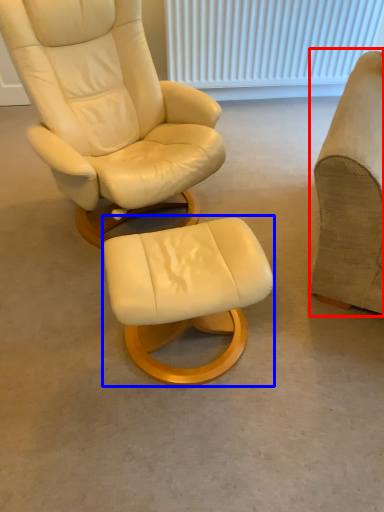
Question: Which point is closer to the camera, chair (highlighted by a red box) or stool (highlighted by a blue box)?

Choices:
 (A) chair
 (B) stool

Answer: (A)